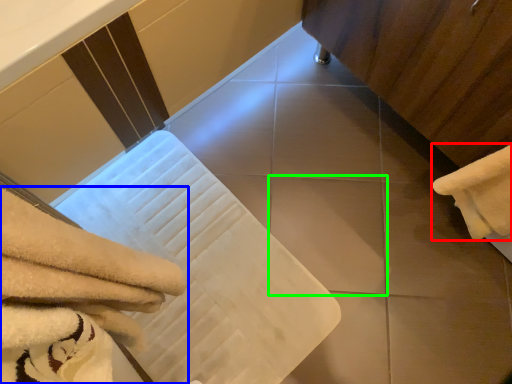
Question: Based on their relative distances, which object is nearer to towel (highlighted by a red box)? Choose from towel (highlighted by a blue box) and tile (highlighted by a green box).

Choices:
 (A) towel
 (B) tile

Answer: (B)